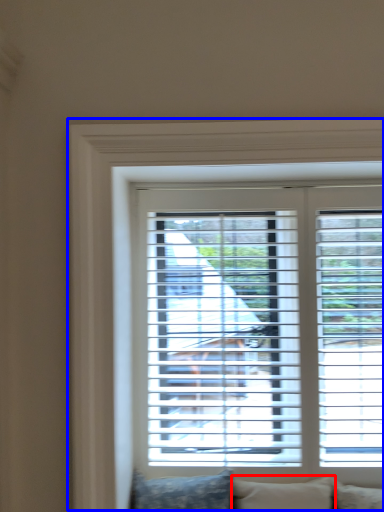
Question: Which object is further to the camera taking this photo, pillow (highlighted by a red box) or window (highlighted by a blue box)?

Choices:
 (A) pillow
 (B) window

Answer: (B)